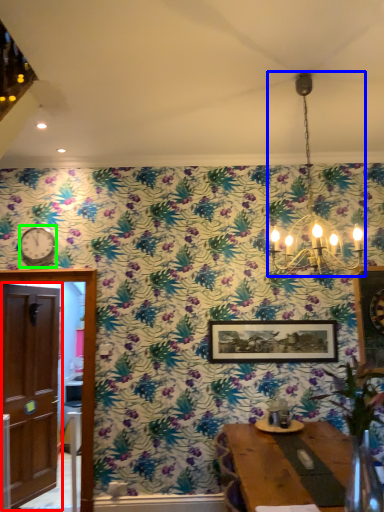
Question: Considering the real-world distances, which object is farthest from door (highlighted by a red box)? light fixture (highlighted by a blue box) or clock (highlighted by a green box)?

Choices:
 (A) light fixture
 (B) clock

Answer: (A)